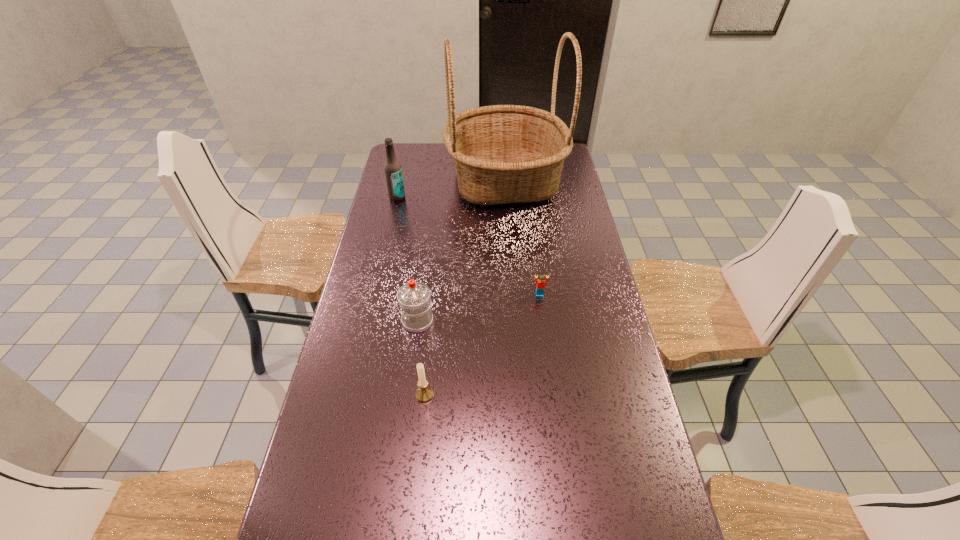
This screenshot has height=540, width=960. I want to click on vacant space situated on the side of the second tallest object with the label, so click(385, 253).

Where is `free location located 0.120m on the handle side of the water bottle`? Image resolution: width=960 pixels, height=540 pixels. free location located 0.120m on the handle side of the water bottle is located at coordinates point(363,321).

The image size is (960, 540). I want to click on vacant space located on the handle side of the water bottle, so click(353, 321).

You are a GUI agent. You are given a task and a screenshot of the screen. Output one action in this format:
    pyautogui.click(x=<x>, y=<y>)
    Task: Click on the free space located on the handle side of the water bottle
    
    Given the screenshot: What is the action you would take?
    pyautogui.click(x=386, y=321)

This screenshot has width=960, height=540. Identify the location of vacant space located on the front of the second shortest object. (414, 503).

Locate an element on the screen. This screenshot has height=540, width=960. vacant area situated 0.190m on the face of the third nearest object is located at coordinates (546, 345).

At what (x,y) coordinates should I click in order to perform the action: click on object present at the far edge. Please return your answer as a coordinate pair (x, y). Looking at the image, I should click on (502, 154).

The width and height of the screenshot is (960, 540). I want to click on object that is at the left edge, so click(393, 172).

The height and width of the screenshot is (540, 960). In order to click on object that is at the right edge in this screenshot , I will do `click(502, 154)`.

Image resolution: width=960 pixels, height=540 pixels. I want to click on object that is at the far right corner, so click(x=502, y=154).